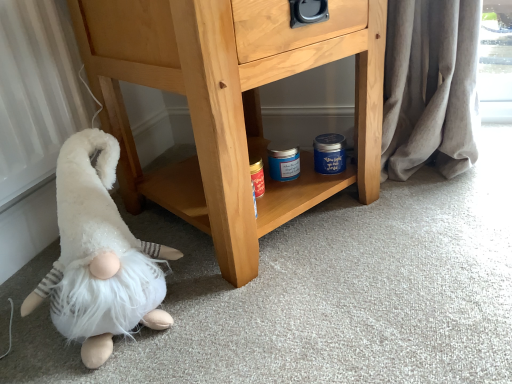
Identify the location of vacant area located to the right-hand side of white fluffy gnome at lower left. (240, 304).